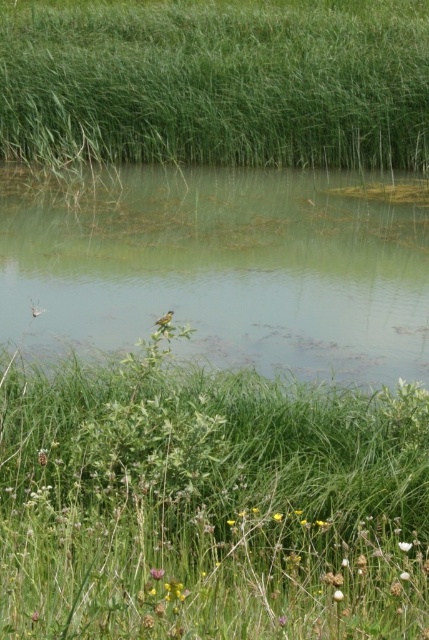
In the scene shown: Does green leafy grass at center have a greater height compared to green grassy lake at center?

No, green leafy grass at center is not taller than green grassy lake at center.

Is green leafy grass at center thinner than green grassy lake at center?

Correct, green leafy grass at center's width is less than green grassy lake at center's.

Which is in front, point (314, 547) or point (33, 186)?

Point (314, 547) is in front.

This screenshot has width=429, height=640. In order to click on green leafy grass at center in this screenshot , I will do `click(208, 504)`.

What do you see at coordinates (208, 504) in the screenshot?
I see `green leafy grass at center` at bounding box center [208, 504].

Is green leafy grass at center shorter than yellow-green textured bird at center?

Incorrect, green leafy grass at center's height does not fall short of yellow-green textured bird at center's.

You are a GUI agent. You are given a task and a screenshot of the screen. Output one action in this format:
    pyautogui.click(x=<x>, y=<y>)
    Task: Click on the green leafy grass at center
    This screenshot has width=429, height=640.
    Given the screenshot: What is the action you would take?
    pyautogui.click(x=208, y=504)

Which is more to the left, green grassy lake at center or green grass at upper center?

green grassy lake at center is more to the left.

Can you confirm if green grassy lake at center is shorter than green grass at upper center?

Yes.

Image resolution: width=429 pixels, height=640 pixels. What are the coordinates of `green grassy lake at center` in the screenshot? It's located at (223, 266).